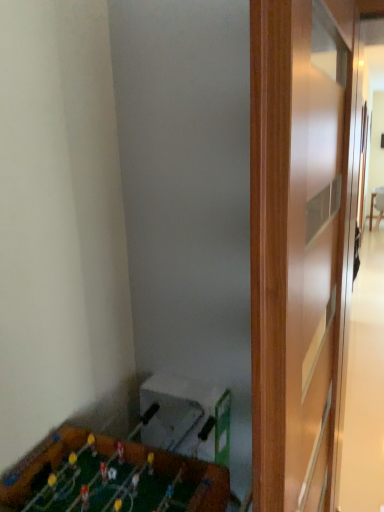
Question: Could you tell me if wooden table at right is facing wooden foosball table at lower left?

Choices:
 (A) yes
 (B) no

Answer: (B)

Question: Is wooden table at right to the left of wooden foosball table at lower left from the viewer's perspective?

Choices:
 (A) yes
 (B) no

Answer: (B)

Question: Is there a large distance between wooden table at right and wooden foosball table at lower left?

Choices:
 (A) no
 (B) yes

Answer: (B)

Question: Is wooden table at right smaller than wooden foosball table at lower left?

Choices:
 (A) no
 (B) yes

Answer: (B)

Question: From the image's perspective, is wooden table at right below wooden foosball table at lower left?

Choices:
 (A) yes
 (B) no

Answer: (B)

Question: Considering the relative sizes of wooden table at right and wooden foosball table at lower left in the image provided, is wooden table at right thinner than wooden foosball table at lower left?

Choices:
 (A) yes
 (B) no

Answer: (A)

Question: From the image's perspective, is wooden foosball table at lower left below wooden table at right?

Choices:
 (A) no
 (B) yes

Answer: (B)

Question: Does wooden foosball table at lower left have a smaller size compared to wooden table at right?

Choices:
 (A) yes
 (B) no

Answer: (B)

Question: Are wooden foosball table at lower left and wooden table at right far apart?

Choices:
 (A) yes
 (B) no

Answer: (A)

Question: Does wooden foosball table at lower left touch wooden table at right?

Choices:
 (A) yes
 (B) no

Answer: (B)

Question: From a real-world perspective, is wooden foosball table at lower left below wooden table at right?

Choices:
 (A) no
 (B) yes

Answer: (A)

Question: Can you confirm if wooden foosball table at lower left is wider than wooden table at right?

Choices:
 (A) no
 (B) yes

Answer: (B)

Question: Looking at their shapes, would you say wooden table at right is wider or thinner than wooden foosball table at lower left?

Choices:
 (A) thin
 (B) wide

Answer: (A)